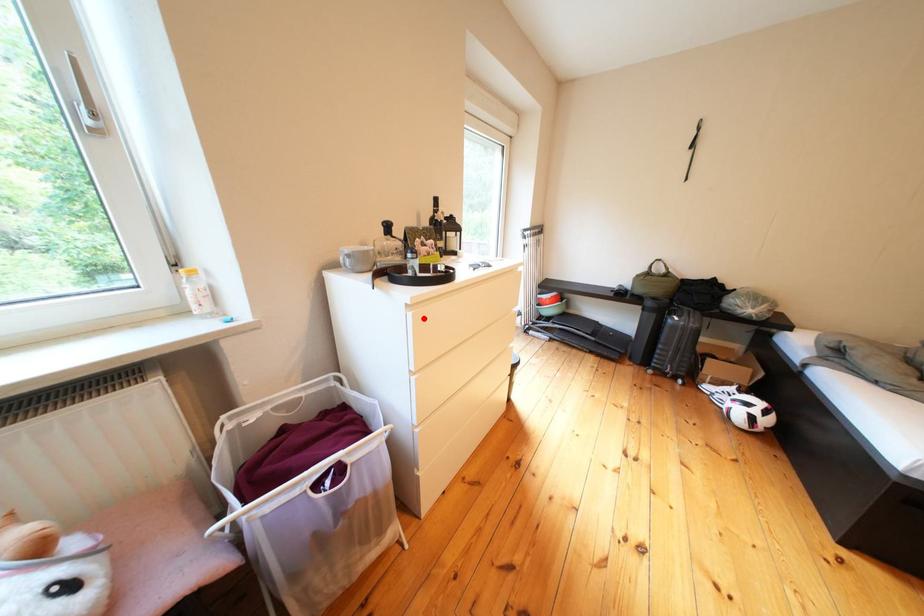
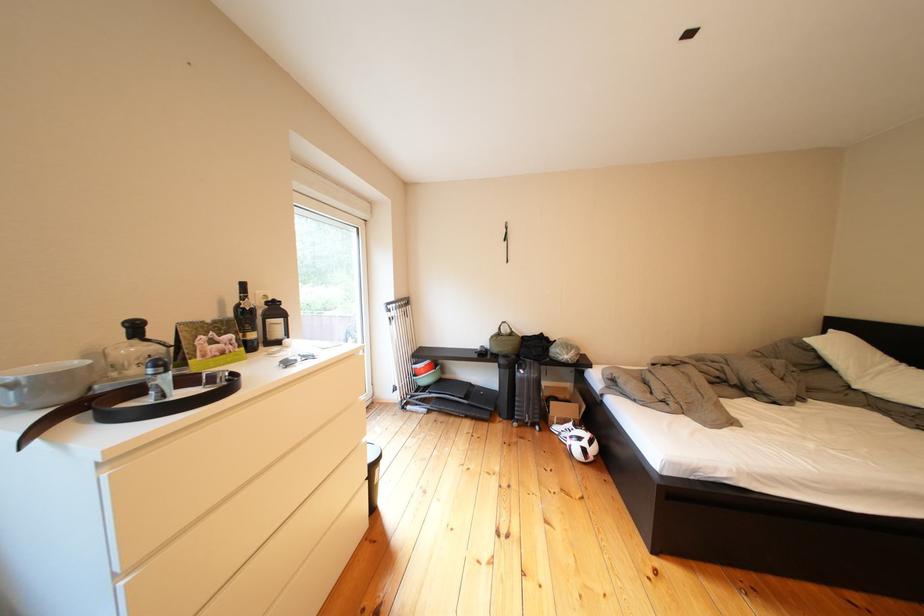
Where in the second image is the point corresponding to the highlighted location from the first image?

(118, 482)